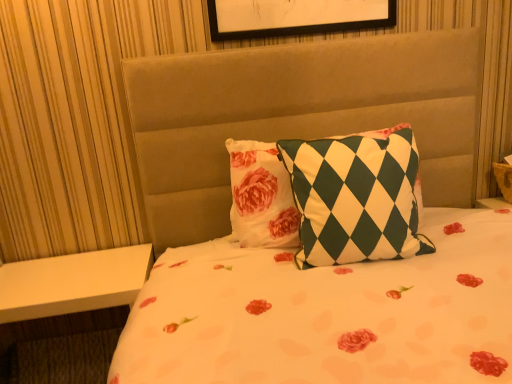
Measure the distance between white matte table at lower left and camera.

white matte table at lower left is 1.36 meters away from camera.

Locate an element on the screen. This screenshot has height=384, width=512. white matte table at lower left is located at coordinates (73, 282).

What do you see at coordinates (73, 282) in the screenshot? I see `white matte table at lower left` at bounding box center [73, 282].

This screenshot has width=512, height=384. What do you see at coordinates (355, 198) in the screenshot?
I see `green and white checkered pillow at center` at bounding box center [355, 198].

This screenshot has height=384, width=512. Find the location of `green and white checkered pillow at center`. green and white checkered pillow at center is located at coordinates (355, 198).

Consider the image. In order to face green and white checkered pillow at center, should I rotate leftwards or rightwards?

Rotate right and turn 13.372 degrees.

Identify the location of white matte table at lower left. The width and height of the screenshot is (512, 384). (73, 282).

Between green and white checkered pillow at center and white matte table at lower left, which one appears on the right side from the viewer's perspective?

Positioned to the right is green and white checkered pillow at center.

Consider the image. Is green and white checkered pillow at center positioned before white matte table at lower left?

Yes, the depth of green and white checkered pillow at center is less than that of white matte table at lower left.

Is point (393, 167) farther from viewer compared to point (151, 253)?

No, it is not.

From the image's perspective, would you say green and white checkered pillow at center is shown under white matte table at lower left?

Incorrect, from the image's perspective, green and white checkered pillow at center is higher than white matte table at lower left.

From a real-world perspective, which object rests below the other?

white matte table at lower left, from a real-world perspective.

In the scene shown: Considering the relative sizes of green and white checkered pillow at center and white matte table at lower left in the image provided, is green and white checkered pillow at center thinner than white matte table at lower left?

Indeed, green and white checkered pillow at center has a lesser width compared to white matte table at lower left.

Consider the image. Considering the relative sizes of green and white checkered pillow at center and white matte table at lower left in the image provided, is green and white checkered pillow at center shorter than white matte table at lower left?

Indeed, green and white checkered pillow at center has a lesser height compared to white matte table at lower left.

Considering the sizes of objects green and white checkered pillow at center and white matte table at lower left in the image provided, who is bigger, green and white checkered pillow at center or white matte table at lower left?

white matte table at lower left.

Is green and white checkered pillow at center spatially inside white matte table at lower left, or outside of it?

green and white checkered pillow at center is not enclosed by white matte table at lower left.

Does green and white checkered pillow at center touch white matte table at lower left?

No, green and white checkered pillow at center is not with white matte table at lower left.

Is white matte table at lower left at the back of green and white checkered pillow at center?

No.

Can you tell me how much green and white checkered pillow at center and white matte table at lower left differ in facing direction?

The facing directions of green and white checkered pillow at center and white matte table at lower left are 0.856 degrees apart.

The image size is (512, 384). Identify the location of table below the green and white checkered pillow at center (from a real-world perspective). (73, 282).

Can you confirm if white matte table at lower left is positioned to the left of green and white checkered pillow at center?

Indeed, white matte table at lower left is positioned on the left side of green and white checkered pillow at center.

From the picture: Does white matte table at lower left come in front of green and white checkered pillow at center?

No, it is behind green and white checkered pillow at center.

Is point (96, 291) closer or farther from the camera than point (349, 253)?

Point (96, 291).

From the image's perspective, which one is positioned lower, white matte table at lower left or green and white checkered pillow at center?

From the image's view, white matte table at lower left is below.

From a real-world perspective, does white matte table at lower left stand above green and white checkered pillow at center?

No, from a real-world perspective, white matte table at lower left is not above green and white checkered pillow at center.

Considering the sizes of objects white matte table at lower left and green and white checkered pillow at center in the image provided, who is thinner, white matte table at lower left or green and white checkered pillow at center?

green and white checkered pillow at center is thinner.

Between white matte table at lower left and green and white checkered pillow at center, which one has more height?

Standing taller between the two is white matte table at lower left.

Who is bigger, white matte table at lower left or green and white checkered pillow at center?

Bigger between the two is white matte table at lower left.

Is white matte table at lower left situated inside green and white checkered pillow at center or outside?

white matte table at lower left exists outside the volume of green and white checkered pillow at center.

Is there a large distance between white matte table at lower left and green and white checkered pillow at center?

No.

Is white matte table at lower left facing away from green and white checkered pillow at center?

No, white matte table at lower left is not facing the opposite direction of green and white checkered pillow at center.

Where is `table that is below the green and white checkered pillow at center (from the image's perspective)`? table that is below the green and white checkered pillow at center (from the image's perspective) is located at coordinates (73, 282).

The height and width of the screenshot is (384, 512). I want to click on table on the left of green and white checkered pillow at center, so 73,282.

At what (x,y) coordinates should I click in order to perform the action: click on pillow in front of the white matte table at lower left. Please return your answer as a coordinate pair (x, y). Image resolution: width=512 pixels, height=384 pixels. Looking at the image, I should click on (355, 198).